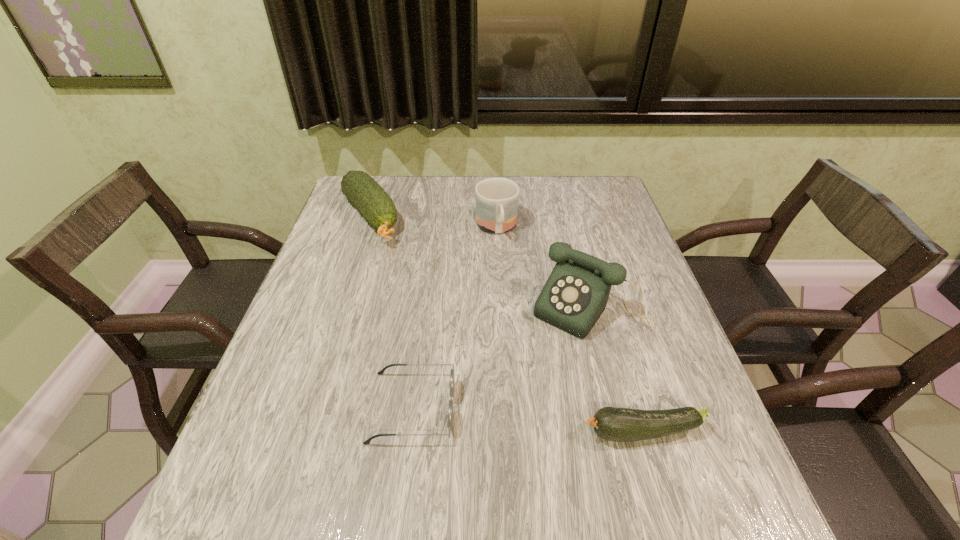
The height and width of the screenshot is (540, 960). I want to click on vacant spot on the desktop that is between the sunglasses and the zucchini and is positioned on the side with the handle of the second tallest object, so click(542, 421).

This screenshot has height=540, width=960. I want to click on free spot on the desktop that is between the sunglasses and the zucchini and is positioned on the dial of the third nearest object, so click(514, 418).

The height and width of the screenshot is (540, 960). Find the location of `vacant spot on the desktop that is between the sunglasses and the zucchini and is positioned at the blossom end of the leftmost object`. vacant spot on the desktop that is between the sunglasses and the zucchini and is positioned at the blossom end of the leftmost object is located at coordinates (516, 418).